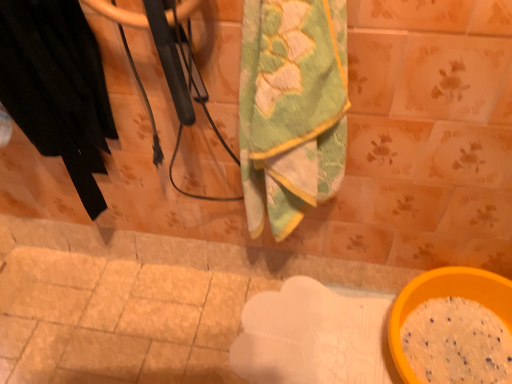
Question: Could black fabric at left be considered to be inside yellow plastic bowl at lower right?

Choices:
 (A) no
 (B) yes

Answer: (A)

Question: Does yellow plastic bowl at lower right have a smaller size compared to black fabric at left?

Choices:
 (A) yes
 (B) no

Answer: (A)

Question: Is yellow plastic bowl at lower right to the right of black fabric at left from the viewer's perspective?

Choices:
 (A) no
 (B) yes

Answer: (B)

Question: Is yellow plastic bowl at lower right positioned with its back to black fabric at left?

Choices:
 (A) yes
 (B) no

Answer: (B)

Question: Does yellow plastic bowl at lower right appear on the left side of black fabric at left?

Choices:
 (A) no
 (B) yes

Answer: (A)

Question: Does yellow plastic bowl at lower right have a greater height compared to black fabric at left?

Choices:
 (A) yes
 (B) no

Answer: (B)

Question: Is green textured towel at center at the left side of yellow plastic bowl at lower right?

Choices:
 (A) no
 (B) yes

Answer: (B)

Question: Is green textured towel at center surrounding yellow plastic bowl at lower right?

Choices:
 (A) no
 (B) yes

Answer: (A)

Question: Can we say green textured towel at center lies outside yellow plastic bowl at lower right?

Choices:
 (A) no
 (B) yes

Answer: (B)

Question: Can you confirm if green textured towel at center is taller than yellow plastic bowl at lower right?

Choices:
 (A) yes
 (B) no

Answer: (A)

Question: Considering the relative sizes of green textured towel at center and yellow plastic bowl at lower right in the image provided, is green textured towel at center shorter than yellow plastic bowl at lower right?

Choices:
 (A) no
 (B) yes

Answer: (A)

Question: From the image's perspective, does green textured towel at center appear higher than yellow plastic bowl at lower right?

Choices:
 (A) yes
 (B) no

Answer: (A)

Question: Is yellow plastic bowl at lower right facing away from green textured towel at center?

Choices:
 (A) no
 (B) yes

Answer: (A)